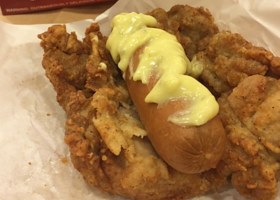
What are the coordinates of `tabletop` in the screenshot? It's located at (29, 18), (0, 14).